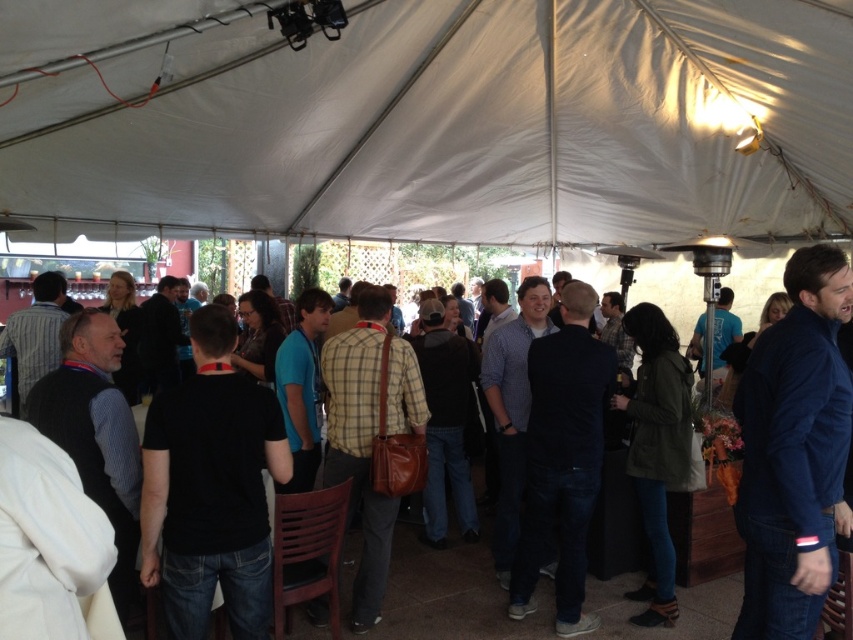
Can you confirm if white fabric canopy at upper center is positioned below black shirt at center?

Incorrect, white fabric canopy at upper center is not positioned below black shirt at center.

Who is lower down, white fabric canopy at upper center or black shirt at center?

black shirt at center

Where is `white fabric canopy at upper center`? The image size is (853, 640). white fabric canopy at upper center is located at coordinates (430, 120).